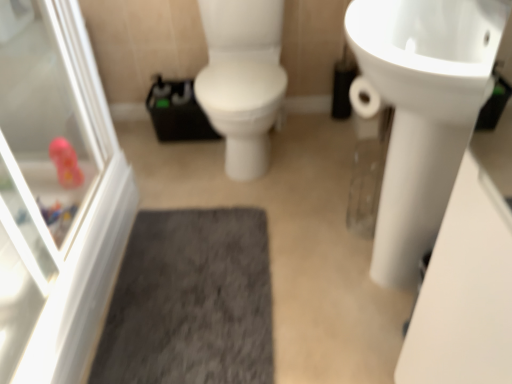
Question: Should I look upward or downward to see gray shaggy bath mat at center?

Choices:
 (A) down
 (B) up

Answer: (A)

Question: From a real-world perspective, does white glossy screen door at left stand above white glossy sink at upper right?

Choices:
 (A) no
 (B) yes

Answer: (A)

Question: Is white glossy screen door at left taller than white glossy sink at upper right?

Choices:
 (A) no
 (B) yes

Answer: (B)

Question: Is white glossy screen door at left not within white glossy sink at upper right?

Choices:
 (A) yes
 (B) no

Answer: (A)

Question: Is white glossy screen door at left surrounding white glossy sink at upper right?

Choices:
 (A) no
 (B) yes

Answer: (A)

Question: Does white glossy screen door at left turn towards white glossy sink at upper right?

Choices:
 (A) no
 (B) yes

Answer: (B)

Question: From a real-world perspective, is white glossy screen door at left beneath white glossy sink at upper right?

Choices:
 (A) yes
 (B) no

Answer: (A)

Question: From a real-world perspective, is white glossy sink at upper right over white glossy screen door at left?

Choices:
 (A) yes
 (B) no

Answer: (A)

Question: Is white glossy sink at upper right oriented towards white glossy screen door at left?

Choices:
 (A) no
 (B) yes

Answer: (B)

Question: Is white glossy sink at upper right wider than white glossy screen door at left?

Choices:
 (A) yes
 (B) no

Answer: (A)

Question: Is white glossy sink at upper right to the left of white glossy screen door at left from the viewer's perspective?

Choices:
 (A) no
 (B) yes

Answer: (A)

Question: Considering the relative sizes of white glossy sink at upper right and white glossy screen door at left in the image provided, is white glossy sink at upper right bigger than white glossy screen door at left?

Choices:
 (A) yes
 (B) no

Answer: (A)

Question: From the image's perspective, is white glossy sink at upper right under white glossy screen door at left?

Choices:
 (A) no
 (B) yes

Answer: (A)

Question: Considering the relative sizes of gray shaggy bath mat at center and white glossy screen door at left in the image provided, is gray shaggy bath mat at center taller than white glossy screen door at left?

Choices:
 (A) yes
 (B) no

Answer: (B)